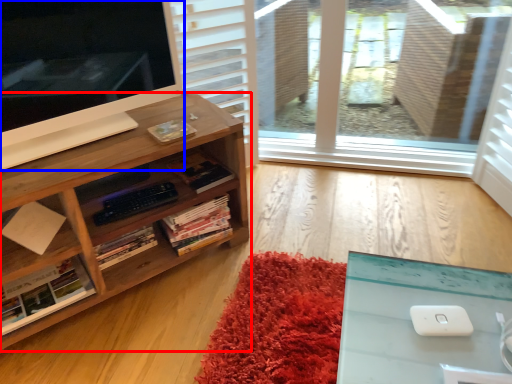
Question: Which object appears farthest to the camera in this image, bookcase (highlighted by a red box) or computer monitor (highlighted by a blue box)?

Choices:
 (A) bookcase
 (B) computer monitor

Answer: (A)